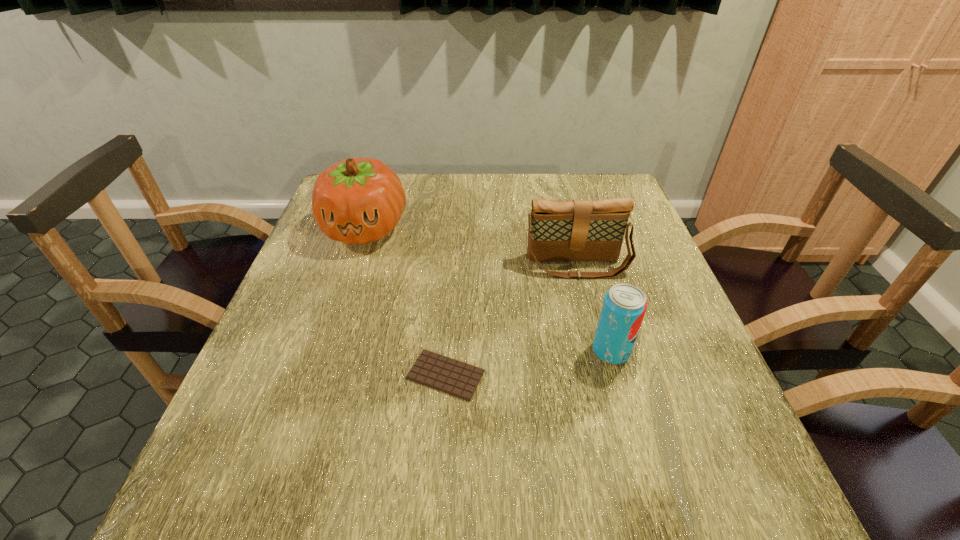
I want to click on pumpkin, so click(x=358, y=200).

You are a GUI agent. You are given a task and a screenshot of the screen. Output one action in this format:
    pyautogui.click(x=<x>, y=<y>)
    Task: Click on the leftmost object
    
    Given the screenshot: What is the action you would take?
    pyautogui.click(x=358, y=200)

What are the coordinates of `shoulder bag` in the screenshot? It's located at (579, 230).

I want to click on soda can, so click(624, 306).

What are the coordinates of `the shortest object` in the screenshot? It's located at (456, 378).

You are a GUI agent. You are given a task and a screenshot of the screen. Output one action in this format:
    pyautogui.click(x=<x>, y=<y>)
    Task: Click on the second object from left to right
    
    Given the screenshot: What is the action you would take?
    pyautogui.click(x=456, y=378)

This screenshot has width=960, height=540. Find the location of `vacant position located on the side of the tallest object with the cute face`. vacant position located on the side of the tallest object with the cute face is located at coordinates (349, 278).

At what (x,y) coordinates should I click in order to perform the action: click on vacant region located 0.320m on the front-facing side of the shoulder bag. Please return your answer as a coordinate pair (x, y). Looking at the image, I should click on (610, 400).

Identify the location of vacant point located 0.070m on the back of the soda can. (600, 312).

You are a GUI agent. You are given a task and a screenshot of the screen. Output one action in this format:
    pyautogui.click(x=<x>, y=<y>)
    Task: Click on the free location located 0.130m on the right of the shortest object
    Image resolution: width=960 pixels, height=540 pixels.
    Given the screenshot: What is the action you would take?
    pyautogui.click(x=554, y=375)